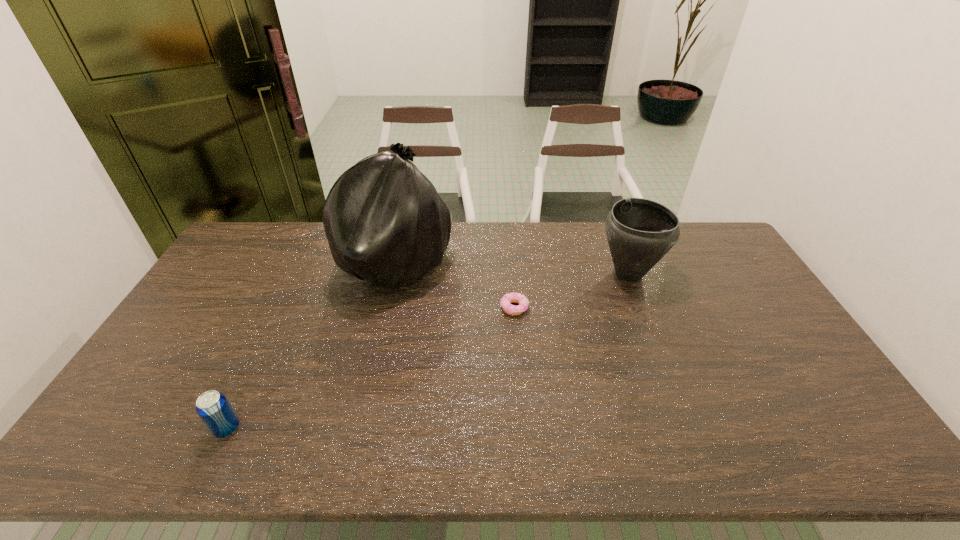
In order to click on empty space between the urn and the doughnut in this screenshot , I will do `click(571, 291)`.

Find the location of `free space between the plastic bag and the third object from left to right`. free space between the plastic bag and the third object from left to right is located at coordinates (455, 287).

This screenshot has width=960, height=540. I want to click on vacant point located between the leftmost object and the rightmost object, so [x=428, y=350].

Identify the location of empty location between the second shortest object and the rightmost object. (428, 350).

At what (x,y) coordinates should I click in order to perform the action: click on empty location between the rightmost object and the beer can. Please return your answer as a coordinate pair (x, y). Image resolution: width=960 pixels, height=540 pixels. Looking at the image, I should click on (428, 350).

Image resolution: width=960 pixels, height=540 pixels. Find the location of `free point between the leftmost object and the plastic bag`. free point between the leftmost object and the plastic bag is located at coordinates (311, 347).

Where is `unoccupied area between the leftmost object and the urn`? Image resolution: width=960 pixels, height=540 pixels. unoccupied area between the leftmost object and the urn is located at coordinates (428, 350).

Locate an element on the screen. vacant area that lies between the nearest object and the doughnut is located at coordinates pos(371,368).

Where is `free spot between the plastic bag and the rightmost object`? The height and width of the screenshot is (540, 960). free spot between the plastic bag and the rightmost object is located at coordinates (512, 269).

You are a GUI agent. You are given a task and a screenshot of the screen. Output one action in this format:
    pyautogui.click(x=<x>, y=<y>)
    Task: Click on the object that is the third closest to the doughnut
    This screenshot has width=960, height=540.
    Given the screenshot: What is the action you would take?
    pyautogui.click(x=214, y=409)